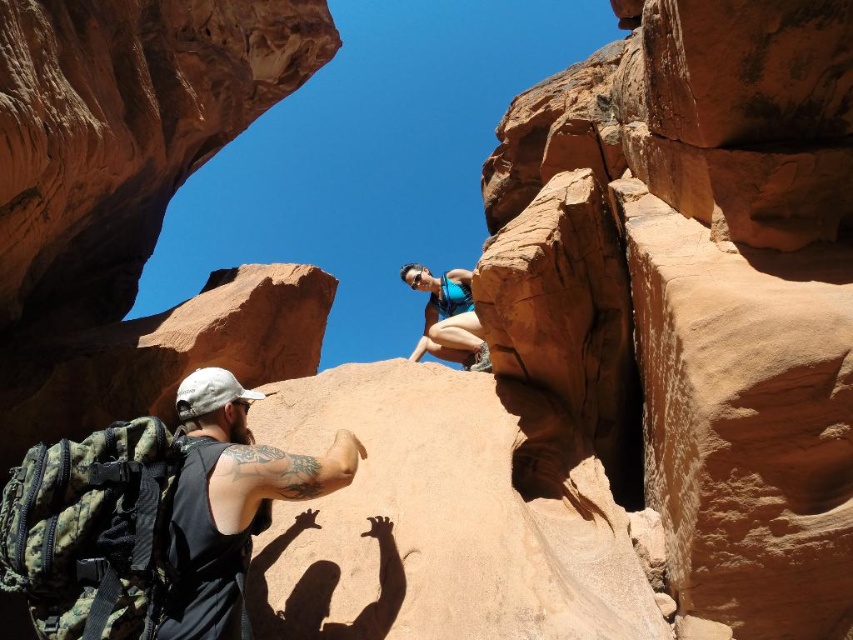
Is smooth sandstone rock at upper center below matte blue tank top at upper center?

Incorrect, smooth sandstone rock at upper center is not positioned below matte blue tank top at upper center.

Which of these two, smooth sandstone rock at upper center or matte blue tank top at upper center, stands shorter?

Standing shorter between the two is matte blue tank top at upper center.

What do you see at coordinates (697, 289) in the screenshot?
I see `smooth sandstone rock at upper center` at bounding box center [697, 289].

Identify the location of smooth sandstone rock at upper center. (697, 289).

Can you confirm if camouflage backpack at lower left is wider than matte blue tank top at upper center?

In fact, camouflage backpack at lower left might be narrower than matte blue tank top at upper center.

Does camouflage backpack at lower left have a greater height compared to matte blue tank top at upper center?

In fact, camouflage backpack at lower left may be shorter than matte blue tank top at upper center.

Is point (183, 433) positioned before point (463, 340)?

Yes, it is in front of point (463, 340).

Locate an element on the screen. The image size is (853, 640). camouflage backpack at lower left is located at coordinates (231, 500).

Who is shorter, smooth sandstone rock at upper center or camouflage backpack at lower left?

camouflage backpack at lower left is shorter.

The height and width of the screenshot is (640, 853). What do you see at coordinates (697, 289) in the screenshot?
I see `smooth sandstone rock at upper center` at bounding box center [697, 289].

Between point (703, 426) and point (227, 589), which one is positioned behind?

The point (703, 426) is behind.

The height and width of the screenshot is (640, 853). Find the location of `smooth sandstone rock at upper center`. smooth sandstone rock at upper center is located at coordinates (697, 289).